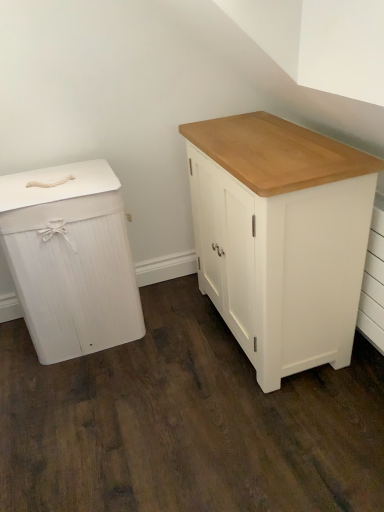
Question: Is point (62, 231) closer or farther from the camera than point (254, 247)?

Choices:
 (A) farther
 (B) closer

Answer: (A)

Question: In terms of width, does white wood chest of drawers at left, which is the second chest of drawers in right-to-left order, look wider or thinner when compared to white painted wood cabinet at center, which is the 2th chest of drawers from left to right?

Choices:
 (A) thin
 (B) wide

Answer: (B)

Question: Is white wood chest of drawers at left, which is the second chest of drawers in right-to-left order, spatially inside white painted wood cabinet at center, the first chest of drawers viewed from the right, or outside of it?

Choices:
 (A) outside
 (B) inside

Answer: (A)

Question: From a real-world perspective, is white painted wood cabinet at center, which is the 2th chest of drawers from left to right, above or below white wood chest of drawers at left, which is the second chest of drawers in right-to-left order?

Choices:
 (A) above
 (B) below

Answer: (A)

Question: Based on their positions, is white painted wood cabinet at center, the first chest of drawers viewed from the right, located to the left or right of white wood chest of drawers at left, the first chest of drawers positioned from the left?

Choices:
 (A) left
 (B) right

Answer: (B)

Question: In terms of height, does white painted wood cabinet at center, which is the 2th chest of drawers from left to right, look taller or shorter compared to white wood chest of drawers at left, the first chest of drawers positioned from the left?

Choices:
 (A) short
 (B) tall

Answer: (B)

Question: Considering the positions of white painted wood cabinet at center, the first chest of drawers viewed from the right, and white wood chest of drawers at left, which is the second chest of drawers in right-to-left order, in the image, is white painted wood cabinet at center, the first chest of drawers viewed from the right, bigger or smaller than white wood chest of drawers at left, which is the second chest of drawers in right-to-left order,?

Choices:
 (A) small
 (B) big

Answer: (B)